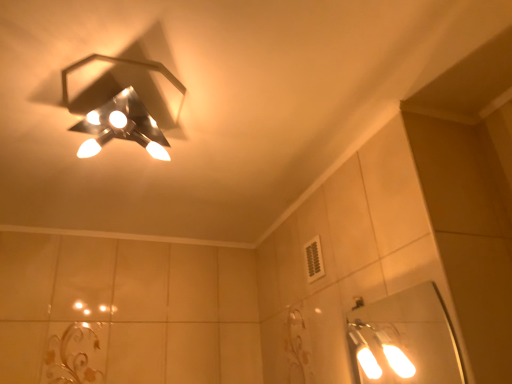
Question: Should I look upward or downward to see metallic hexagonal light fixture at upper left?

Choices:
 (A) down
 (B) up

Answer: (B)

Question: Should I look upward or downward to see white glossy mirror at lower right?

Choices:
 (A) up
 (B) down

Answer: (B)

Question: From the image's perspective, would you say white glossy mirror at lower right is shown under metallic hexagonal light fixture at upper left?

Choices:
 (A) yes
 (B) no

Answer: (A)

Question: Does white glossy mirror at lower right contain metallic hexagonal light fixture at upper left?

Choices:
 (A) yes
 (B) no

Answer: (B)

Question: From the image's perspective, is white glossy mirror at lower right on top of metallic hexagonal light fixture at upper left?

Choices:
 (A) yes
 (B) no

Answer: (B)

Question: Is white glossy mirror at lower right with metallic hexagonal light fixture at upper left?

Choices:
 (A) no
 (B) yes

Answer: (A)

Question: Does white glossy mirror at lower right appear on the right side of metallic hexagonal light fixture at upper left?

Choices:
 (A) yes
 (B) no

Answer: (A)

Question: Is white glossy mirror at lower right far away from metallic hexagonal light fixture at upper left?

Choices:
 (A) no
 (B) yes

Answer: (B)

Question: Is metallic hexagonal light fixture at upper left closer to the viewer compared to white glossy mirror at lower right?

Choices:
 (A) no
 (B) yes

Answer: (B)

Question: Is metallic hexagonal light fixture at upper left thinner than white glossy mirror at lower right?

Choices:
 (A) no
 (B) yes

Answer: (A)

Question: Is metallic hexagonal light fixture at upper left aimed at white glossy mirror at lower right?

Choices:
 (A) yes
 (B) no

Answer: (B)

Question: Is metallic hexagonal light fixture at upper left bigger than white glossy mirror at lower right?

Choices:
 (A) yes
 (B) no

Answer: (A)

Question: Can you confirm if metallic hexagonal light fixture at upper left is wider than white glossy mirror at lower right?

Choices:
 (A) no
 (B) yes

Answer: (B)

Question: Is white glossy mirror at lower right surrounded by metallic hexagonal light fixture at upper left?

Choices:
 (A) yes
 (B) no

Answer: (B)

Question: From the image's perspective, is white glossy mirror at lower right positioned above or below metallic hexagonal light fixture at upper left?

Choices:
 (A) above
 (B) below

Answer: (B)